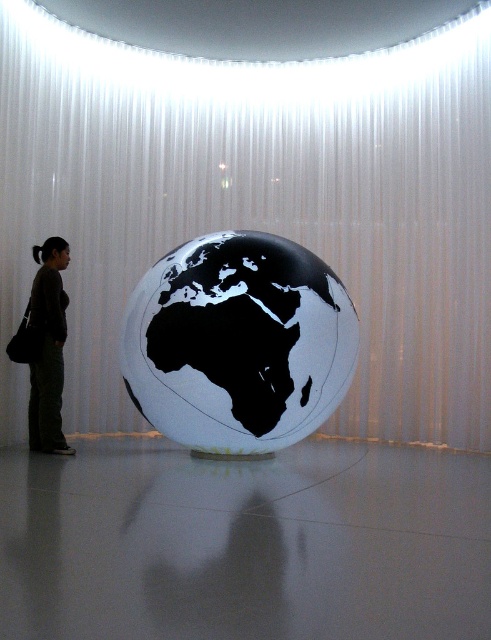
Question: Can you confirm if white sheer curtain at center is wider than brown fabric pants at left?

Choices:
 (A) no
 (B) yes

Answer: (B)

Question: Which object is the farthest from the brown fabric pants at left?

Choices:
 (A) white sheer curtain at center
 (B) white glossy globe at center

Answer: (A)

Question: Based on their relative distances, which object is nearer to the white sheer curtain at center?

Choices:
 (A) white glossy globe at center
 (B) brown fabric pants at left

Answer: (A)

Question: Does white sheer curtain at center have a greater width compared to white glossy globe at center?

Choices:
 (A) yes
 (B) no

Answer: (B)

Question: Among these objects, which one is nearest to the camera?

Choices:
 (A) white sheer curtain at center
 (B) brown fabric pants at left

Answer: (B)

Question: Is white sheer curtain at center behind brown fabric pants at left?

Choices:
 (A) yes
 (B) no

Answer: (A)